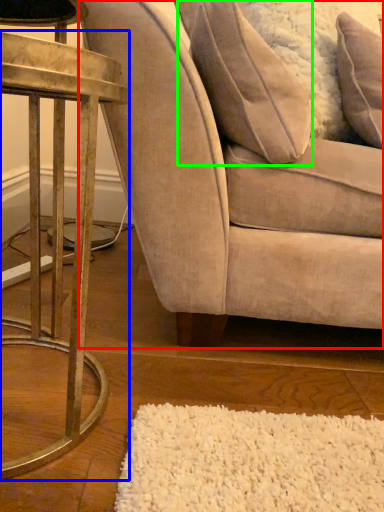
Question: Based on their relative distances, which object is nearer to chair (highlighted by a red box)? Choose from table (highlighted by a blue box) and pillow (highlighted by a green box).

Choices:
 (A) table
 (B) pillow

Answer: (B)